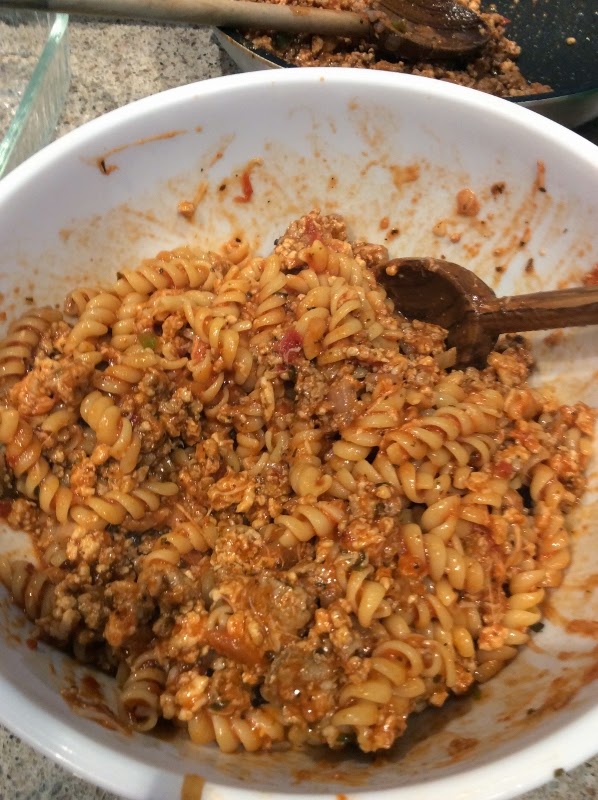
The height and width of the screenshot is (800, 598). Identify the location of bowl. [523, 697], [591, 61].